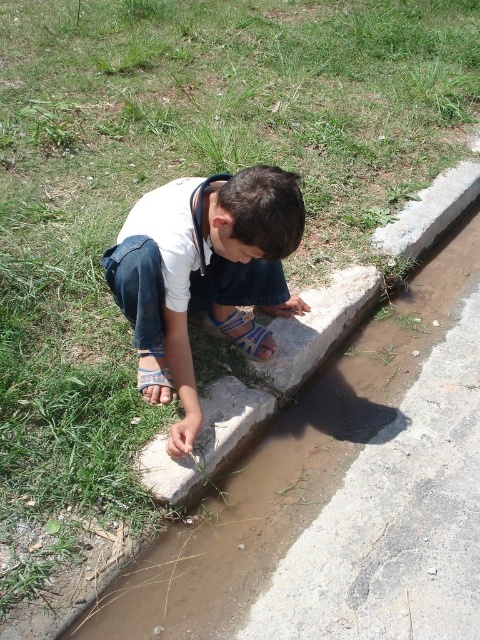
Question: Is white cotton shirt at center positioned at the back of denim at left?

Choices:
 (A) yes
 (B) no

Answer: (B)

Question: Which object appears farthest from the camera in this image?

Choices:
 (A) denim at left
 (B) white cotton shirt at center

Answer: (A)

Question: Is white cotton shirt at center closer to the viewer compared to denim at left?

Choices:
 (A) yes
 (B) no

Answer: (A)

Question: Which point is closer to the camera?

Choices:
 (A) denim at left
 (B) white cotton shirt at center

Answer: (B)

Question: Does white cotton shirt at center lie behind denim at left?

Choices:
 (A) yes
 (B) no

Answer: (B)

Question: Which object appears closest to the camera in this image?

Choices:
 (A) denim at left
 (B) white cotton shirt at center

Answer: (B)